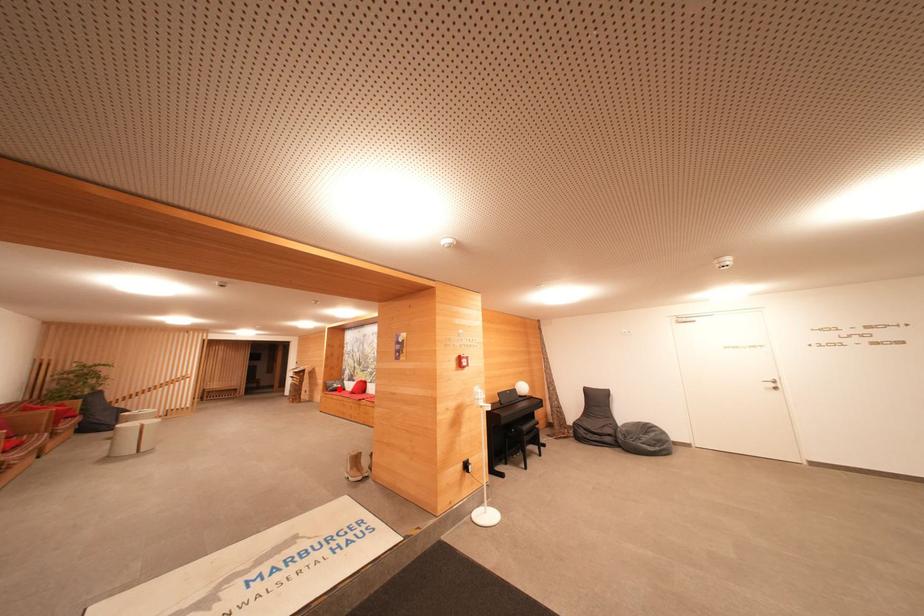
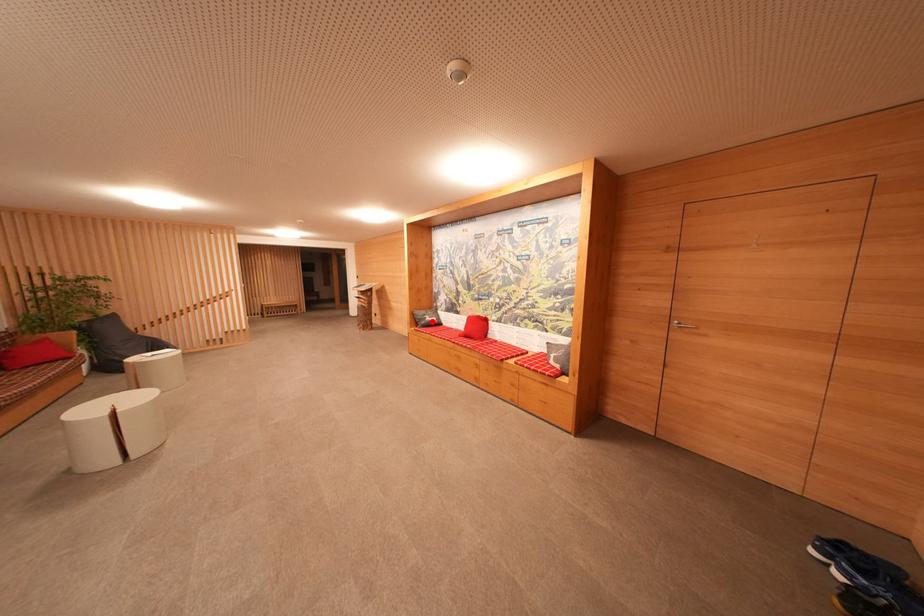
I am providing you with two images of the same scene from different viewpoints. A red point is marked on the first image and another point is marked on the second image. Does the point marked in image1 correspond to the same location as the one in image2?

Yes